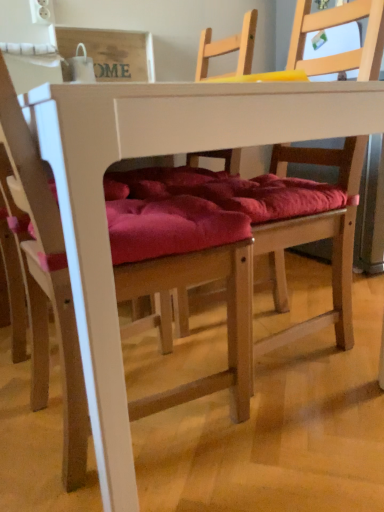
Question: Looking at the image, does wooden chair with red cushion at center, acting as the second chair starting from the left, seem bigger or smaller compared to velvet red cushion at center, positioned as the 1th chair in left-to-right order?

Choices:
 (A) small
 (B) big

Answer: (B)

Question: From a real-world perspective, is wooden chair with red cushion at center, acting as the second chair starting from the left, physically located above or below velvet red cushion at center, positioned as the 1th chair in left-to-right order?

Choices:
 (A) above
 (B) below

Answer: (B)

Question: Which object is positioned farthest from the velvet red cushion at center, positioned as the 1th chair in left-to-right order?

Choices:
 (A) white matte table at center
 (B) wooden chair with red cushion at center, which is counted as the first chair, starting from the right

Answer: (B)

Question: Considering the real-world distances, which object is closest to the white matte table at center?

Choices:
 (A) wooden chair with red cushion at center, acting as the second chair starting from the left
 (B) velvet red cushion at center, positioned as the 1th chair in left-to-right order

Answer: (B)